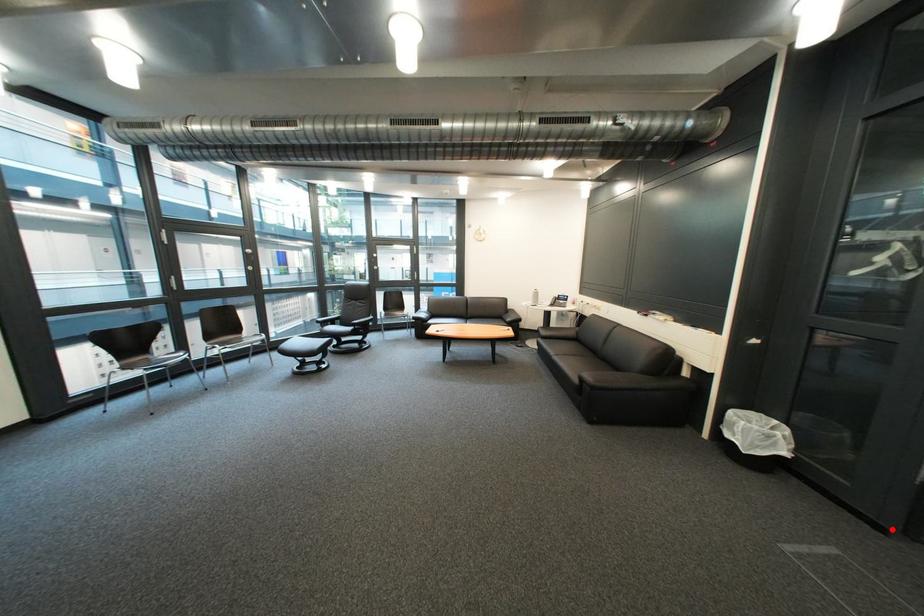
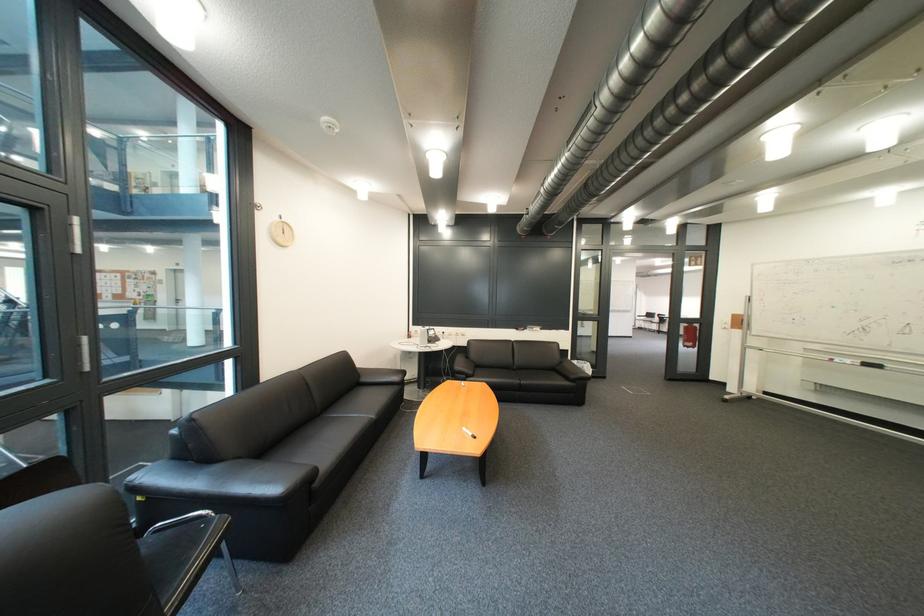
Where in the second image is the point corresponding to the highlighted location from the first image?

(618, 379)